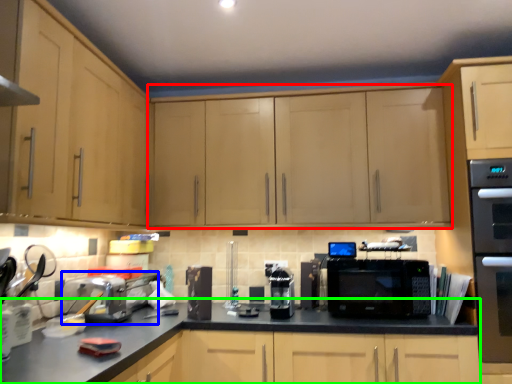
Question: Considering the real-world distances, which object is closest to cabinetry (highlighted by a red box)? appliance (highlighted by a blue box) or counter top (highlighted by a green box).

Choices:
 (A) appliance
 (B) counter top

Answer: (B)